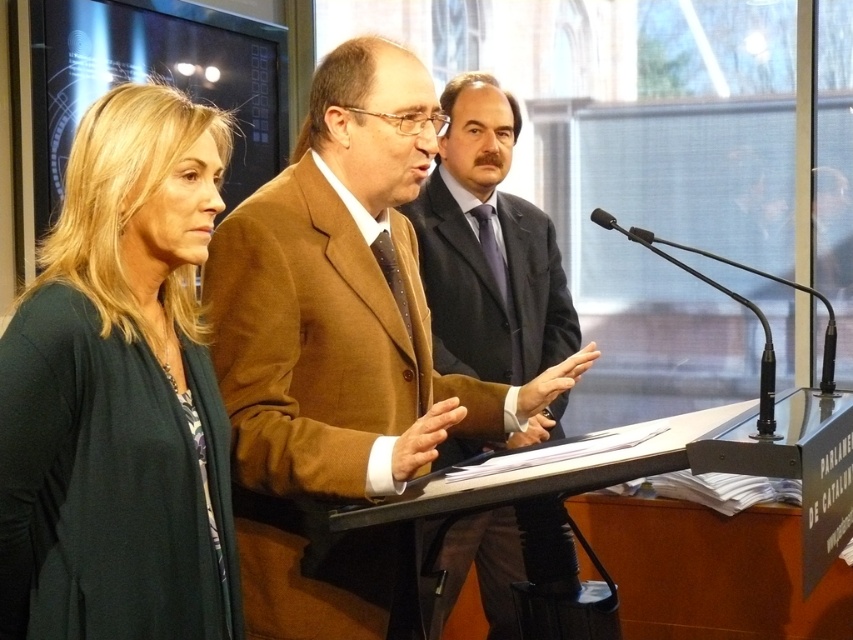
Who is positioned more to the left, dark green sweater at left or black plastic microphone at center?

dark green sweater at left

Is dark green sweater at left wider than black plastic microphone at center?

Indeed, dark green sweater at left has a greater width compared to black plastic microphone at center.

This screenshot has width=853, height=640. What are the coordinates of `dark green sweater at left` in the screenshot? It's located at (x=114, y=403).

Locate an element on the screen. This screenshot has width=853, height=640. dark green sweater at left is located at coordinates (114, 403).

Between brown woolen suit at center and dark green sweater at left, which one has more height?

With more height is brown woolen suit at center.

Between brown woolen suit at center and dark green sweater at left, which one appears on the right side from the viewer's perspective?

From the viewer's perspective, brown woolen suit at center appears more on the right side.

In order to click on brown woolen suit at center in this screenshot , I will do `click(340, 349)`.

Can you confirm if brown woolen suit at center is smaller than brown woolen coat at center?

Yes, brown woolen suit at center is smaller than brown woolen coat at center.

Is brown woolen suit at center positioned in front of brown woolen coat at center?

Yes.

Is point (503, 416) in front of point (509, 563)?

Yes, point (503, 416) is closer to viewer.

You are a GUI agent. You are given a task and a screenshot of the screen. Output one action in this format:
    pyautogui.click(x=<x>, y=<y>)
    Task: Click on the brown woolen suit at center
    
    Given the screenshot: What is the action you would take?
    pyautogui.click(x=340, y=349)